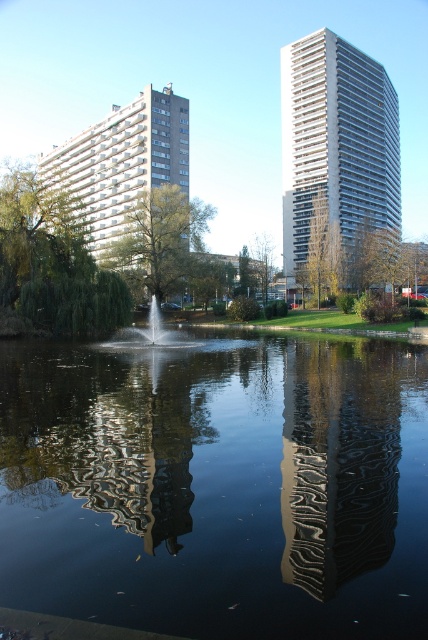
You are standing at the point marked as point (x=82, y=138) in the urban park scene. You want to take a photo of the two high rise buildings in the background. Will you be able to capture both buildings in your camera frame if your camera has a 60 degree field of view?

The point (x=82, y=138) is 146.47 meters away from the viewer. However, the exact positions and sizes of the two high rise buildings relative to this point are not provided in the Objects Description. Therefore, it is impossible to determine if both buildings can fit within a 60 degree field of view without additional information about their distance and angular spread from the point.

You are a photographer planning to capture the reflection of the white textured building at left and the white glossy fountain at center in the water. Which object will have its reflection closer to the photographer?

The white textured building at left is positioned over the white glossy fountain at center, so its reflection will be closer to the photographer.